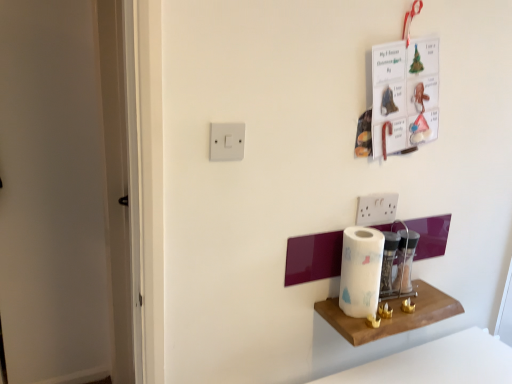
In order to click on empty space that is ontop of wooden shelf at lower right in this screenshot , I will do (x=390, y=304).